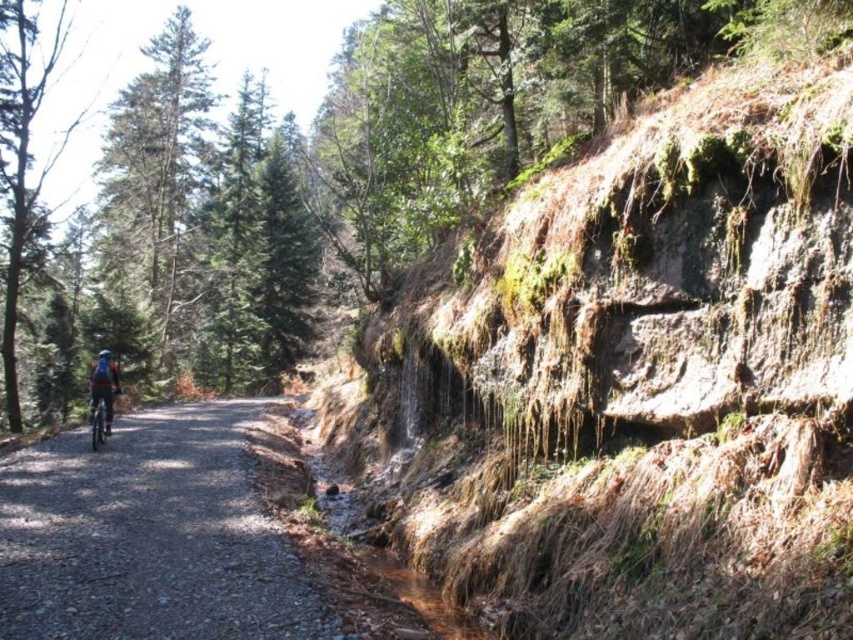
You are standing at the camera position and want to reach the point at coordinates (630,243). If your walking speed is 1.5 meters per second, how long will it take you to reach that point?

The distance to the point is 8.20 meters. At a speed of 1.5 meters per second, it would take approximately 5.47 seconds to reach the point.

In the scene shown: You are a hiker planning to take a photo of both the rusty rock cliff at right and the green matte tree at left. Which object should you stand closer to in order to capture both in the frame without moving the camera?

You should stand closer to the rusty rock cliff at right because it is shorter than the green matte tree at left, allowing both to fit within the camera frame when positioned appropriately.

You are a hiker standing at the starting point of the gravel path. You see the rusty rock cliff at right and the green matte tree at left. Which object is closer to you?

The rusty rock cliff at right is closer to you because it is positioned in front of the green matte tree at left.